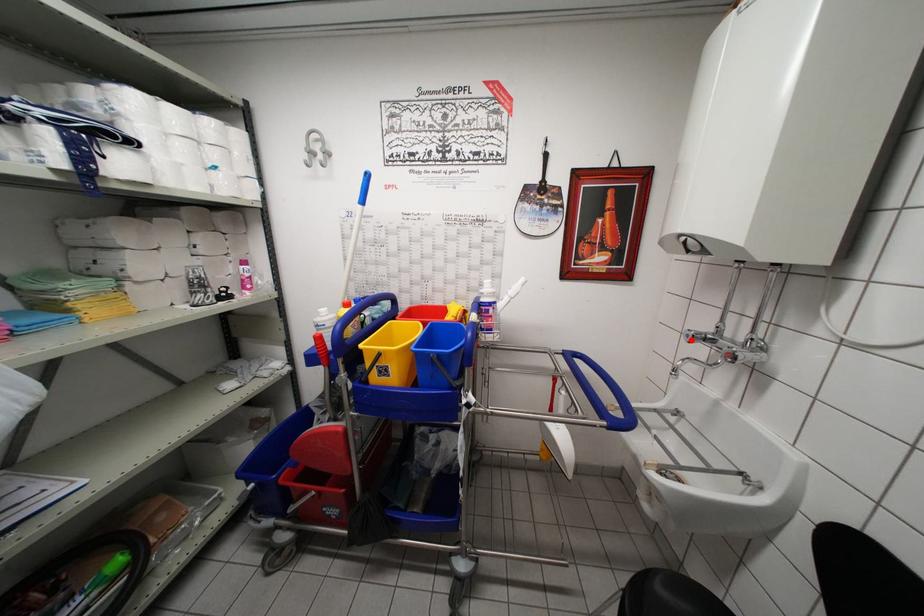
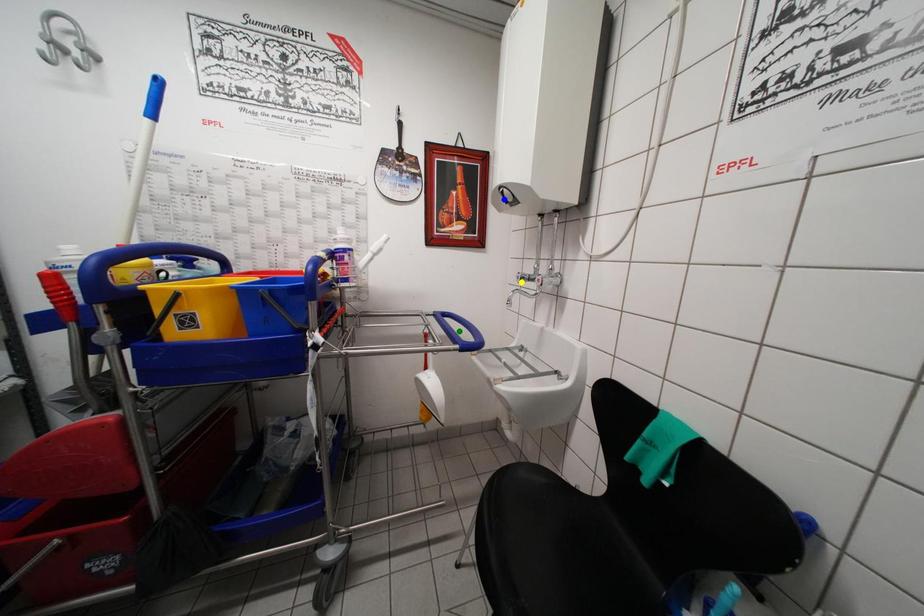
Question: I am providing you with two images of the same scene from different viewpoints. A red point is marked on the first image. You are given multiple points on the second image. Which point in image 2 is actually the same real-world point as the red point in image 1?

Choices:
 (A) blue point
 (B) yellow point
 (C) green point

Answer: (B)